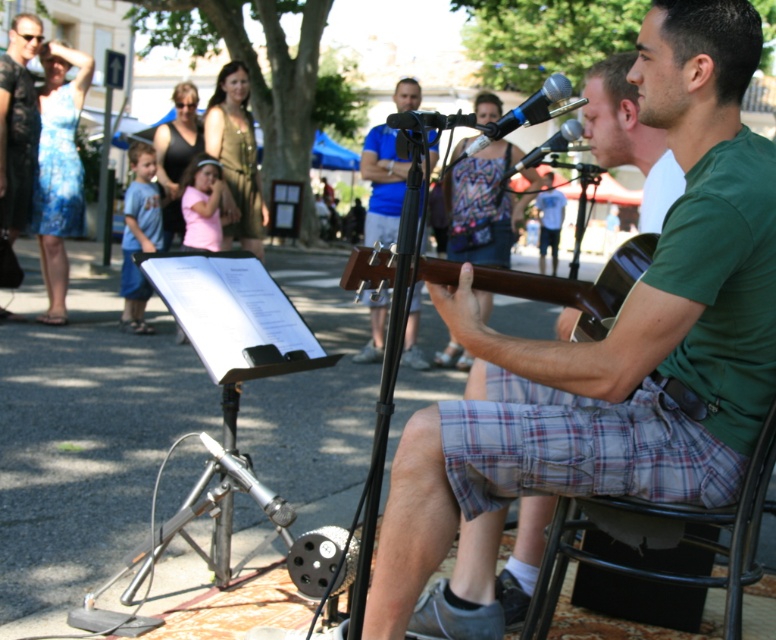
You are a photographer positioned at the center of the scene. You want to capture a photo of the black lace dress at left. Which direction should you move to frame it better?

The black lace dress at left is located at point 0.194 on the x axis and 0.023 on the y axis. Since you are at the center, you should move to the left and down to frame it better.

You are a photographer trying to capture a closeup of the black matte microphone at center without including the black lace dress at left in the frame. Given their sizes, is this possible?

The black lace dress at left is wider than the black matte microphone at center. Since the dress is wider, it might block the view of the microphone unless positioned carefully to avoid overlap.